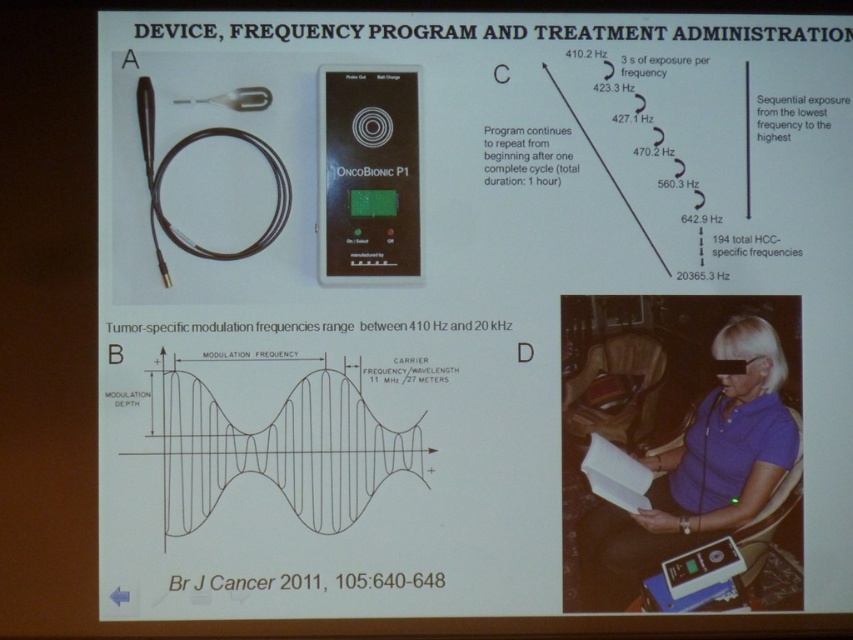
Based on the coordinates provided in the image, where is the point located? Please identify the object at point (x=701, y=467).

The point (x=701, y=467) corresponds to the purple fabric shirt at center.

You are a researcher who needs to ensure proper handling of the black plastic oncobionic p1 at center during a demonstration. Considering the purple fabric shirt at center is being worn by the presenter, what is the minimum safe distance in inches you should maintain between the two to prevent interference?

The purple fabric shirt at center is 14.94 inches from black plastic oncobionic p1 at center, so maintaining at least 14.94 inches distance ensures no interference between the purple fabric shirt at center and the device.

You are examining the ONCOBIONIC P1 device in section A of the slide. There are two points marked on the device, one at coordinates point [700,412] and another at point [367,122]. Which point is closer to you?

Point [700,412] is further to the viewer than point [367,122], so the point closer to you is point [367,122].